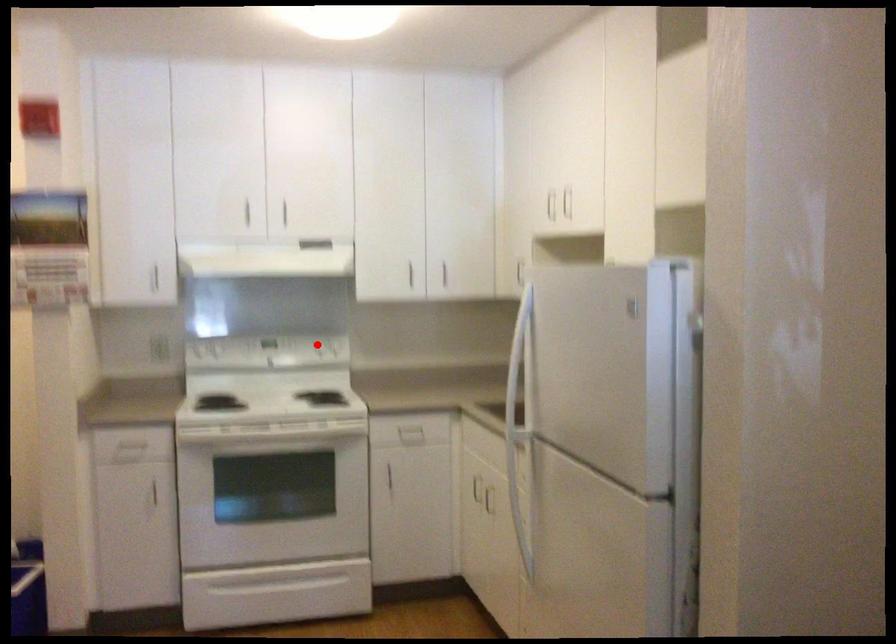
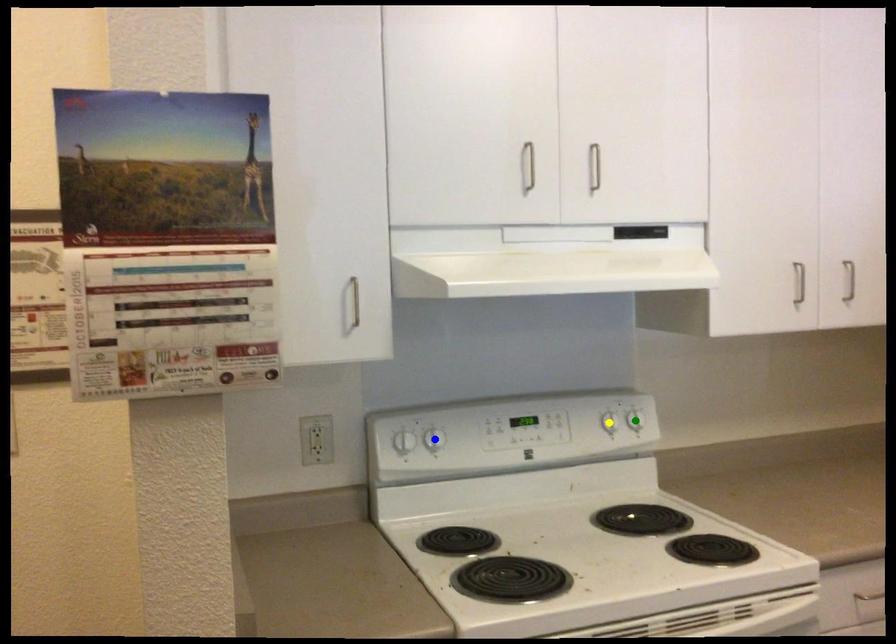
Question: I am providing you with two images of the same scene from different viewpoints. A red point is marked on the first image. You are given multiple points on the second image. Which point in image 2 is actually the same real-world point as the red point in image 1?

Choices:
 (A) blue point
 (B) yellow point
 (C) green point

Answer: (B)